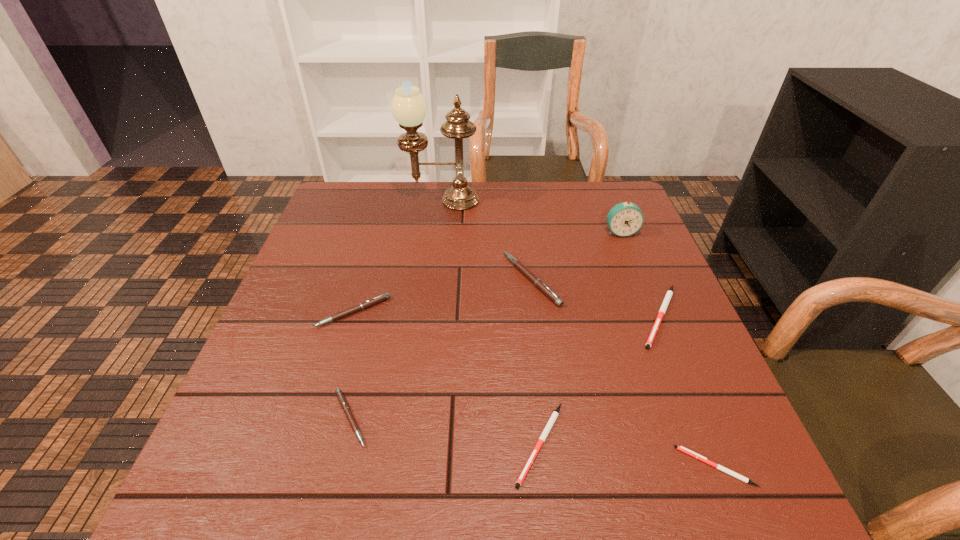
The image size is (960, 540). I want to click on the smallest white pen, so [x=683, y=449].

The width and height of the screenshot is (960, 540). Find the location of `the shortest pen`. the shortest pen is located at coordinates (683, 449).

Locate an element on the screen. This screenshot has height=540, width=960. vacant space located 0.240m on the right of the tallest object is located at coordinates (558, 201).

I want to click on free region located 0.190m on the front-facing side of the alarm clock, so click(642, 286).

Identify the location of vacant space positioned 0.300m at the nib of the biggest pink pen. This screenshot has height=540, width=960. coord(382,280).

I want to click on free spot located at the nib of the biggest pink pen, so click(460, 280).

This screenshot has width=960, height=540. Identify the location of vacant area situated 0.080m at the nib of the biggest pink pen. (472, 280).

This screenshot has height=540, width=960. Identify the location of vacant region located 0.110m at the nib of the second smallest pink pen. (336, 372).

Where is `free spot located on the clicker of the biggest white pen`? The width and height of the screenshot is (960, 540). free spot located on the clicker of the biggest white pen is located at coordinates (719, 459).

I want to click on blank area located 0.210m at the nib of the smallest pink pen, so click(488, 418).